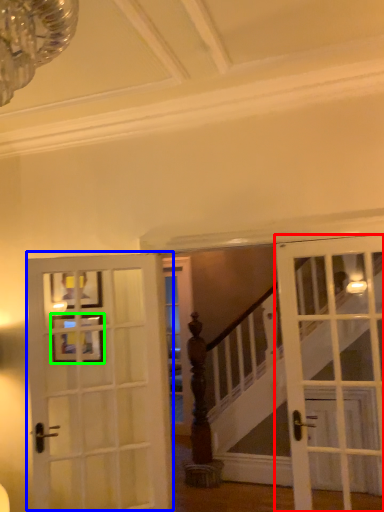
Question: Which object is positioned farthest from door (highlighted by a red box)? Select from door (highlighted by a blue box) and picture frame (highlighted by a green box).

Choices:
 (A) door
 (B) picture frame

Answer: (B)